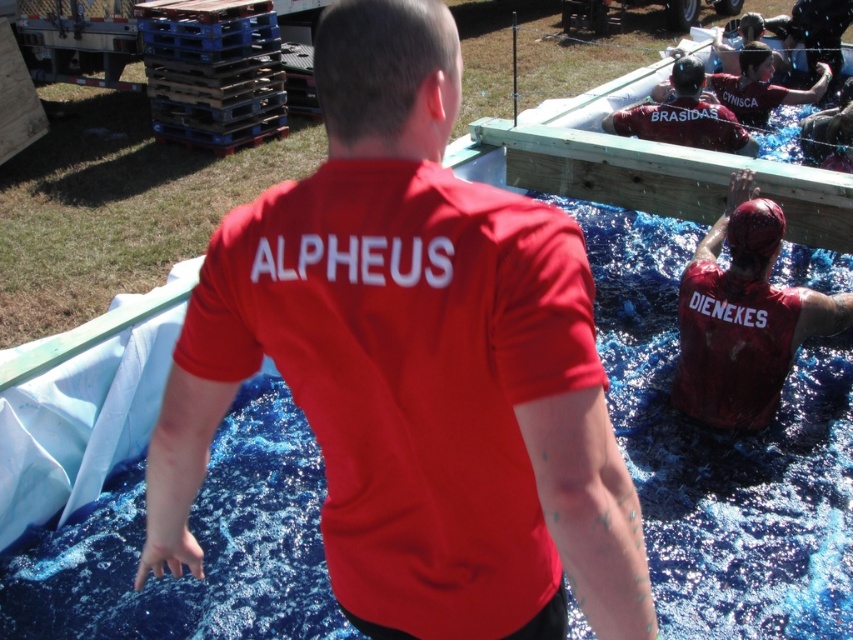
You are a photographer positioned at the edge of the pool. You need to capture a photo where both the matte red shirt at center and the matte red shirt at upper right are visible. Based on their sizes in the image, which shirt should you focus on first to ensure both are in frame?

The matte red shirt at center is taller than the matte red shirt at upper right. Therefore, you should focus on the matte red shirt at upper right first since it is smaller and might be easier to frame alongside the larger one.

You are standing at the edge of the rectangular pool and see the point marked at coordinates [743,316]. What object is located at that point?

The point at coordinates [743,316] indicates the location of the matte red shirt at right.